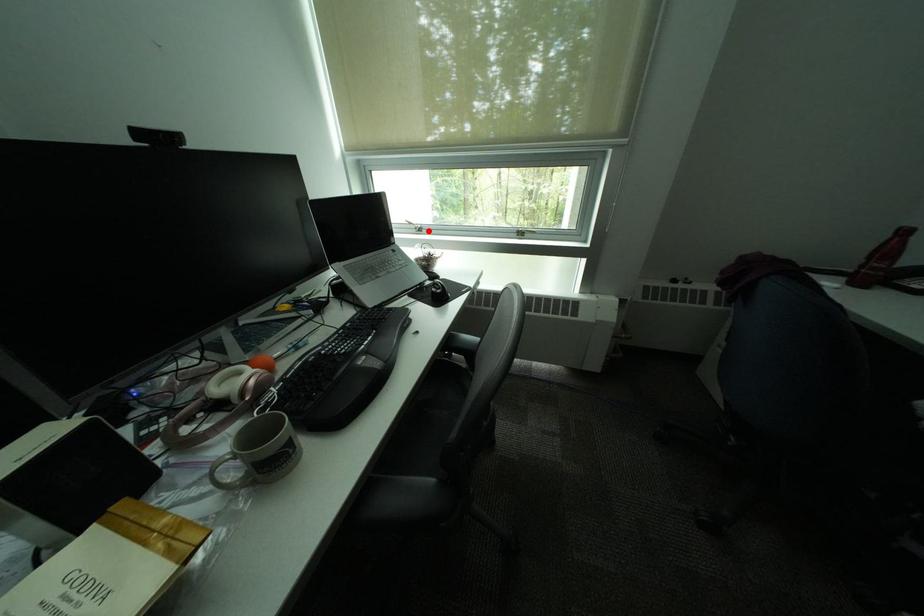
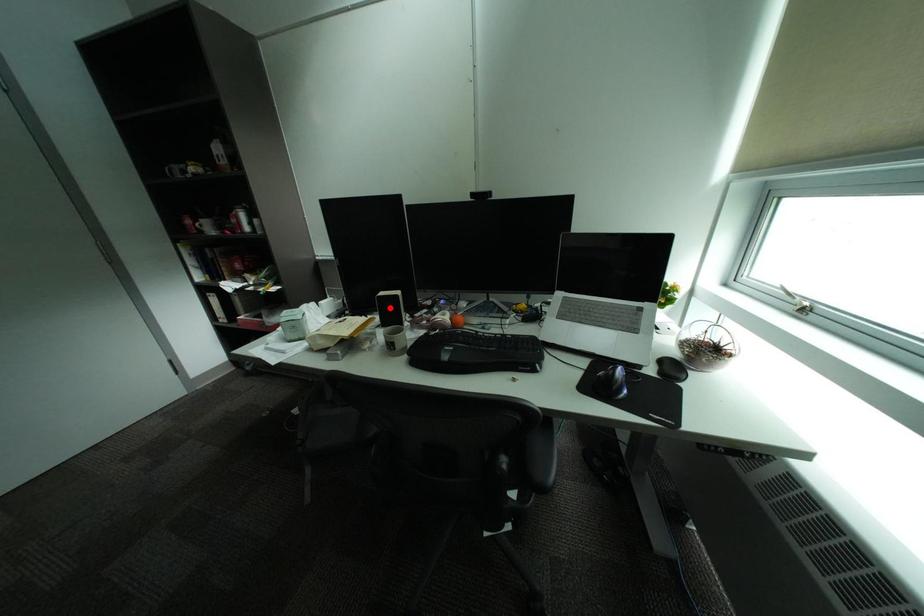
I am providing you with two images of the same scene from different viewpoints. A red point is marked on the first image and another point is marked on the second image. Is the red point in image1 aligned with the point shown in image2?

No